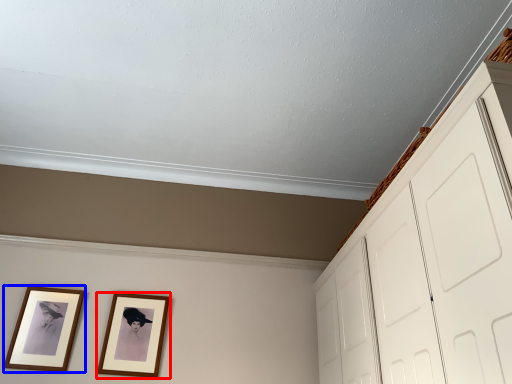
Question: Among these objects, which one is farthest to the camera, picture frame (highlighted by a red box) or picture frame (highlighted by a blue box)?

Choices:
 (A) picture frame
 (B) picture frame

Answer: (A)